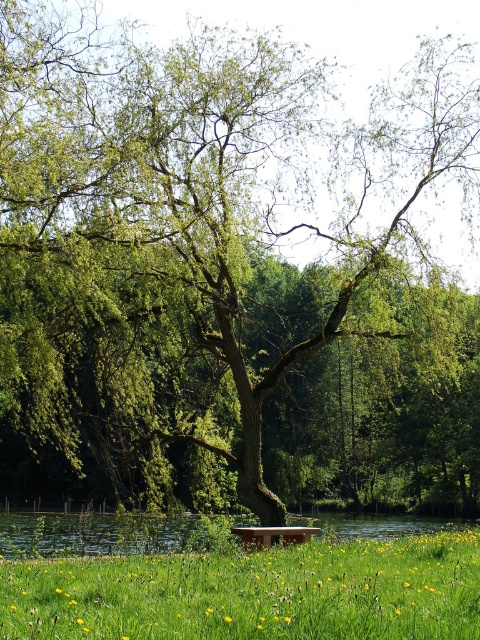
Is green grassy at lower center behind wooden bench at center?

No, green grassy at lower center is closer to the viewer.

Can you confirm if green grassy at lower center is wider than wooden bench at center?

Indeed, green grassy at lower center has a greater width compared to wooden bench at center.

In order to click on green grassy at lower center in this screenshot , I will do [x=253, y=593].

At what (x,y) coordinates should I click in order to perform the action: click on green grassy at lower center. Please return your answer as a coordinate pair (x, y). This screenshot has height=640, width=480. Looking at the image, I should click on click(253, 593).

Does green grassy river at lower center appear on the left side of wooden bench at center?

Indeed, green grassy river at lower center is positioned on the left side of wooden bench at center.

Is point (369, 532) closer to viewer compared to point (279, 534)?

No, (369, 532) is behind (279, 534).

At what (x,y) coordinates should I click in order to perform the action: click on green grassy river at lower center. Please return your answer as a coordinate pair (x, y). Image resolution: width=480 pixels, height=640 pixels. Looking at the image, I should click on tap(92, 532).

Is green grassy at lower center closer to camera compared to green grassy river at lower center?

Yes.

Is green grassy at lower center to the right of green grassy river at lower center from the viewer's perspective?

Yes, green grassy at lower center is to the right of green grassy river at lower center.

Between point (355, 554) and point (36, 522), which one is positioned in front?

Point (355, 554) is in front.

Where is `green grassy at lower center`? green grassy at lower center is located at coordinates (253, 593).